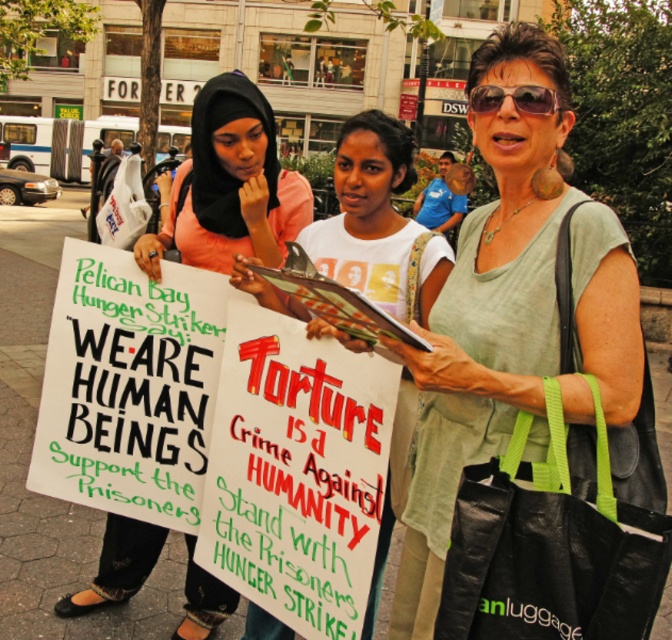
Question: Does matte green shirt at center appear on the left side of shiny black sunglasses at center?

Choices:
 (A) no
 (B) yes

Answer: (B)

Question: Which of the following is the closest to the observer?

Choices:
 (A) (296, 202)
 (B) (501, 93)
 (C) (339, 195)

Answer: (B)

Question: Which object is positioned closest to the white cotton shirt at center?

Choices:
 (A) matte black hijab at center
 (B) shiny black sunglasses at center

Answer: (A)

Question: Is matte green shirt at center further to camera compared to shiny black sunglasses at center?

Choices:
 (A) no
 (B) yes

Answer: (A)

Question: Is matte green shirt at center above white cotton shirt at center?

Choices:
 (A) yes
 (B) no

Answer: (B)

Question: Among these points, which one is nearest to the camera?

Choices:
 (A) (286, 204)
 (B) (333, 246)
 (C) (552, 371)

Answer: (C)